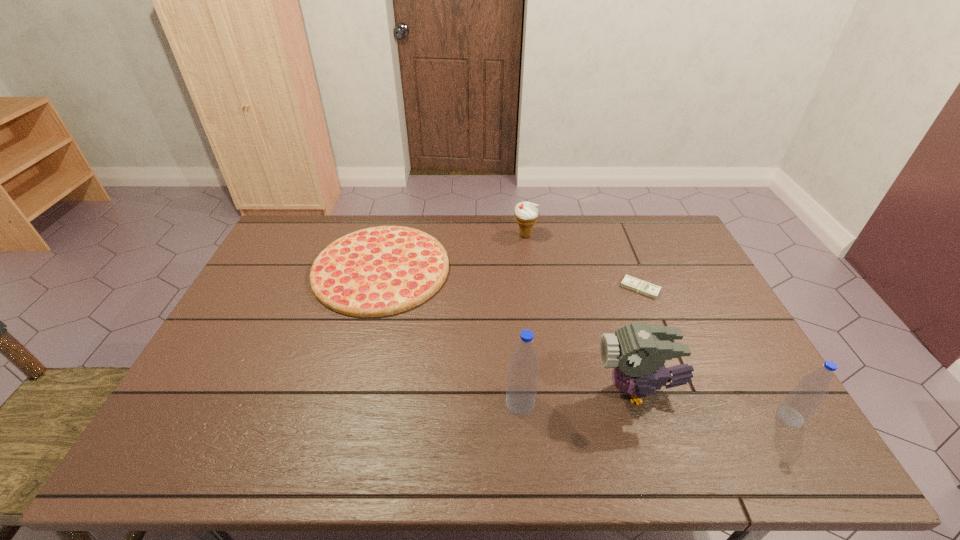
Image resolution: width=960 pixels, height=540 pixels. What are the coordinates of `free space located on the back of the shorter water bottle` in the screenshot? It's located at (726, 308).

Identify the location of vacant area situated on the right of the icecream. (621, 235).

This screenshot has height=540, width=960. Identify the location of blank area located 0.210m on the front of the pizza. (353, 376).

In order to click on blank space located on the right of the money in this screenshot , I will do `click(694, 288)`.

The width and height of the screenshot is (960, 540). In order to click on free region located at the beak of the bird in this screenshot , I will do `click(502, 390)`.

Find the location of a particular element. Image resolution: width=960 pixels, height=540 pixels. vacant area situated 0.210m at the beak of the bird is located at coordinates (511, 390).

Find the location of a particular element. The width and height of the screenshot is (960, 540). free space located at the beak of the bird is located at coordinates (515, 390).

I want to click on icecream present at the far edge, so click(x=526, y=213).

Where is `pizza situated at the far edge`? pizza situated at the far edge is located at coordinates (380, 271).

Where is `bird that is at the near edge`? This screenshot has height=540, width=960. bird that is at the near edge is located at coordinates (637, 352).